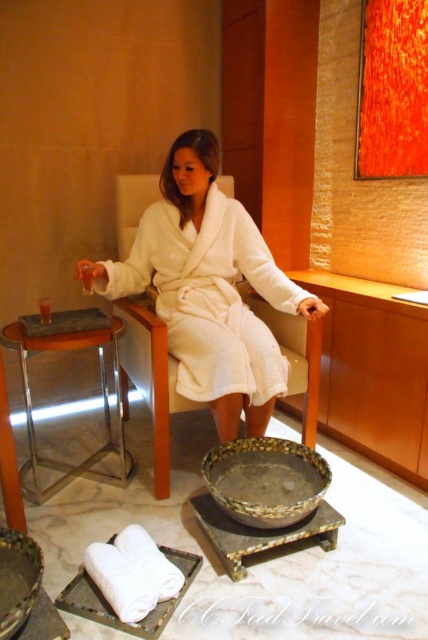
Question: Does white fabric tray at lower left appear on the right side of matte black tray at left?

Choices:
 (A) yes
 (B) no

Answer: (A)

Question: Among these objects, which one is farthest from the camera?

Choices:
 (A) white fabric tray at lower left
 (B) metallic silver stool at left
 (C) rustic ceramic bowl at lower center

Answer: (B)

Question: Which object appears farthest from the camera in this image?

Choices:
 (A) white soft robe at center
 (B) metallic silver stool at left
 (C) matte black tray at left

Answer: (C)

Question: Is rustic ceramic bowl at lower center thinner than white fabric tray at lower left?

Choices:
 (A) no
 (B) yes

Answer: (A)

Question: Which object is closer to the camera taking this photo?

Choices:
 (A) matte black tray at left
 (B) white fabric tray at lower left
 (C) white soft robe at center

Answer: (B)

Question: Is metallic silver stool at left smaller than white fabric tray at lower left?

Choices:
 (A) no
 (B) yes

Answer: (A)